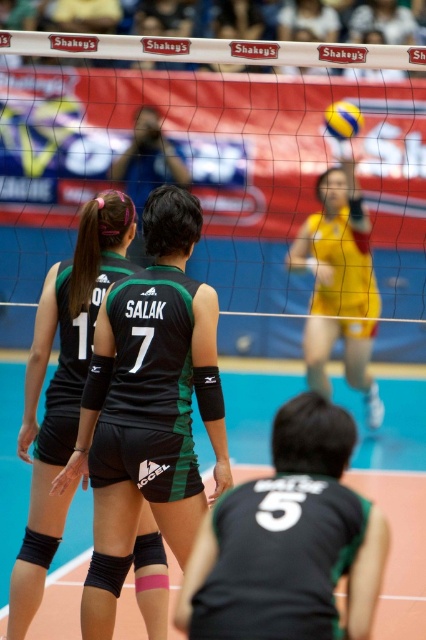
You are a photographer trying to capture the volleyball match. You notice the transparent nylon net at center and the black matte uniform at center. Which object should you focus on if you want to photograph the larger one?

The transparent nylon net at center is bigger than the black matte uniform at center, so you should focus on the transparent nylon net at center to capture the larger object.